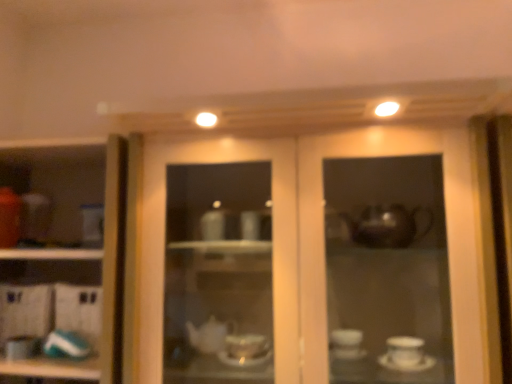
The height and width of the screenshot is (384, 512). Describe the element at coordinates (67, 255) in the screenshot. I see `white glossy cup at left` at that location.

This screenshot has height=384, width=512. What do you see at coordinates (22, 347) in the screenshot?
I see `matte white teapot at lower left, the 2th tableware in the right-to-left sequence` at bounding box center [22, 347].

Locate an element on the screen. matte glass cabinet at center is located at coordinates (311, 240).

Measure the distance between point (57, 330) and camera.

Point (57, 330) is 1.26 meters from camera.

In order to click on white glossy cup at left in this screenshot , I will do `click(67, 255)`.

Does white glossy cup at left appear on the right side of matte glass cabinet at center?

Incorrect, white glossy cup at left is not on the right side of matte glass cabinet at center.

How many degrees apart are the facing directions of white glossy cup at left and matte glass cabinet at center?

The facing directions of white glossy cup at left and matte glass cabinet at center are 0.000178 degrees apart.

From a real-world perspective, is white glossy cup at left above or below matte glass cabinet at center?

white glossy cup at left is below matte glass cabinet at center.

From the image's perspective, would you say matte glass cabinet at center is positioned over white glossy cup at left?

Correct, matte glass cabinet at center appears higher than white glossy cup at left in the image.

Would you consider matte glass cabinet at center to be distant from white glossy cup at left?

matte glass cabinet at center is actually quite close to white glossy cup at left.

Which is in front, matte glass cabinet at center or white glossy cup at left?

matte glass cabinet at center is in front.

Considering the relative positions of matte glass cabinet at center and white glossy cup at left in the image provided, is matte glass cabinet at center to the left of white glossy cup at left from the viewer's perspective?

Incorrect, matte glass cabinet at center is not on the left side of white glossy cup at left.

Based on the photo, is matte white teapot at lower left, the 2th tableware in the right-to-left sequence, at the right side of teal glossy plate at lower left, which appears as the first tableware when viewed from the right?

In fact, matte white teapot at lower left, the 2th tableware in the right-to-left sequence, is to the left of teal glossy plate at lower left, which appears as the first tableware when viewed from the right.

How different are the orientations of matte white teapot at lower left, the 2th tableware in the right-to-left sequence, and teal glossy plate at lower left, the second tableware when ordered from left to right, in degrees?

1.65 degrees.

Is matte white teapot at lower left, which ranks as the first tableware in left-to-right order, oriented away from teal glossy plate at lower left, which appears as the first tableware when viewed from the right?

No, matte white teapot at lower left, which ranks as the first tableware in left-to-right order,'s orientation is not away from teal glossy plate at lower left, which appears as the first tableware when viewed from the right.

Identify the location of tableware above the matte white teapot at lower left, the 2th tableware in the right-to-left sequence (from the image's perspective). (66, 345).

From a real-world perspective, is teal glossy plate at lower left, the second tableware when ordered from left to right, on matte white teapot at lower left, which ranks as the first tableware in left-to-right order?

Yes, from a real-world perspective, teal glossy plate at lower left, the second tableware when ordered from left to right, is on top of matte white teapot at lower left, which ranks as the first tableware in left-to-right order.

Considering the positions of objects teal glossy plate at lower left, which appears as the first tableware when viewed from the right, and matte white teapot at lower left, which ranks as the first tableware in left-to-right order, in the image provided, who is behind, teal glossy plate at lower left, which appears as the first tableware when viewed from the right, or matte white teapot at lower left, which ranks as the first tableware in left-to-right order,?

teal glossy plate at lower left, which appears as the first tableware when viewed from the right.

Can you confirm if teal glossy plate at lower left, the second tableware when ordered from left to right, is bigger than matte white teapot at lower left, which ranks as the first tableware in left-to-right order?

No, teal glossy plate at lower left, the second tableware when ordered from left to right, is not bigger than matte white teapot at lower left, which ranks as the first tableware in left-to-right order.

Is matte white teapot at lower left, the 2th tableware in the right-to-left sequence, spatially inside matte glass cabinet at center, or outside of it?

matte white teapot at lower left, the 2th tableware in the right-to-left sequence, is spatially situated outside matte glass cabinet at center.

Can you confirm if matte white teapot at lower left, the 2th tableware in the right-to-left sequence, is smaller than matte glass cabinet at center?

Yes, matte white teapot at lower left, the 2th tableware in the right-to-left sequence, is smaller than matte glass cabinet at center.

In terms of height, does matte white teapot at lower left, the 2th tableware in the right-to-left sequence, look taller or shorter compared to matte glass cabinet at center?

In the image, matte white teapot at lower left, the 2th tableware in the right-to-left sequence, appears to be shorter than matte glass cabinet at center.

Considering the relative sizes of matte white teapot at lower left, the 2th tableware in the right-to-left sequence, and white glossy cup at left in the image provided, is matte white teapot at lower left, the 2th tableware in the right-to-left sequence, bigger than white glossy cup at left?

No.

You are a GUI agent. You are given a task and a screenshot of the screen. Output one action in this format:
    pyautogui.click(x=<x>, y=<y>)
    Task: Click on the cupboard that is above the matte white teapot at lower left, which ranks as the first tableware in left-to-right order (from a real-world perspective)
    The image size is (512, 384).
    Given the screenshot: What is the action you would take?
    pyautogui.click(x=67, y=255)

Is white glossy cup at left located within matte white teapot at lower left, the 2th tableware in the right-to-left sequence?

Definitely not — white glossy cup at left is not inside matte white teapot at lower left, the 2th tableware in the right-to-left sequence.

From a real-world perspective, is matte white teapot at lower left, which ranks as the first tableware in left-to-right order, positioned over white glossy cup at left based on gravity?

No, from a real-world perspective, matte white teapot at lower left, which ranks as the first tableware in left-to-right order, is not over white glossy cup at left

Looking at this image, can you tell me how much matte glass cabinet at center and teal glossy plate at lower left, which appears as the first tableware when viewed from the right, differ in facing direction?

There is a 4.08-degree angle between the facing directions of matte glass cabinet at center and teal glossy plate at lower left, which appears as the first tableware when viewed from the right.

Looking at this image, are matte glass cabinet at center and teal glossy plate at lower left, which appears as the first tableware when viewed from the right, far apart?

matte glass cabinet at center is actually quite close to teal glossy plate at lower left, which appears as the first tableware when viewed from the right.

From a real-world perspective, who is located lower, matte glass cabinet at center or teal glossy plate at lower left, the second tableware when ordered from left to right?

teal glossy plate at lower left, the second tableware when ordered from left to right, from a real-world perspective.

Between matte glass cabinet at center and teal glossy plate at lower left, which appears as the first tableware when viewed from the right, which one is positioned in front?

matte glass cabinet at center is in front.

Locate an element on the screen. The image size is (512, 384). door that appears above the white glossy cup at left (from the image's perspective) is located at coordinates (311, 240).

Where is `cupboard behind the matte glass cabinet at center`? The width and height of the screenshot is (512, 384). cupboard behind the matte glass cabinet at center is located at coordinates (67, 255).

From the image, which object appears to be farther from teal glossy plate at lower left, the second tableware when ordered from left to right, matte white teapot at lower left, the 2th tableware in the right-to-left sequence, or white glossy cup at left?

white glossy cup at left.

Which object lies nearer to the anchor point matte white teapot at lower left, the 2th tableware in the right-to-left sequence, matte glass cabinet at center or white glossy cup at left?

white glossy cup at left lies closer to matte white teapot at lower left, the 2th tableware in the right-to-left sequence, than the other object.

Which object lies further to the anchor point teal glossy plate at lower left, the second tableware when ordered from left to right, matte white teapot at lower left, which ranks as the first tableware in left-to-right order, or matte glass cabinet at center?

Based on the image, matte glass cabinet at center appears to be further to teal glossy plate at lower left, the second tableware when ordered from left to right.

Estimate the real-world distances between objects in this image. Which object is closer to matte white teapot at lower left, which ranks as the first tableware in left-to-right order, matte glass cabinet at center or teal glossy plate at lower left, the second tableware when ordered from left to right?

teal glossy plate at lower left, the second tableware when ordered from left to right, is closer to matte white teapot at lower left, which ranks as the first tableware in left-to-right order.

From the image, which object appears to be nearer to matte white teapot at lower left, which ranks as the first tableware in left-to-right order, teal glossy plate at lower left, the second tableware when ordered from left to right, or white glossy cup at left?

teal glossy plate at lower left, the second tableware when ordered from left to right, lies closer to matte white teapot at lower left, which ranks as the first tableware in left-to-right order, than the other object.

Estimate the real-world distances between objects in this image. Which object is further from teal glossy plate at lower left, the second tableware when ordered from left to right, white glossy cup at left or matte white teapot at lower left, the 2th tableware in the right-to-left sequence?

white glossy cup at left lies further to teal glossy plate at lower left, the second tableware when ordered from left to right, than the other object.

Based on the photo, when comparing their distances from teal glossy plate at lower left, the second tableware when ordered from left to right, does white glossy cup at left or matte glass cabinet at center seem closer?

white glossy cup at left is positioned closer to the anchor teal glossy plate at lower left, the second tableware when ordered from left to right.

Which object lies nearer to the anchor point matte glass cabinet at center, white glossy cup at left or teal glossy plate at lower left, which appears as the first tableware when viewed from the right?

The object closer to matte glass cabinet at center is white glossy cup at left.

The image size is (512, 384). Identify the location of tableware between matte white teapot at lower left, the 2th tableware in the right-to-left sequence, and matte glass cabinet at center, in the horizontal direction. (66, 345).

I want to click on tableware situated between white glossy cup at left and matte glass cabinet at center from left to right, so click(x=66, y=345).

The height and width of the screenshot is (384, 512). I want to click on cupboard situated between matte white teapot at lower left, which ranks as the first tableware in left-to-right order, and matte glass cabinet at center from left to right, so click(x=67, y=255).

The width and height of the screenshot is (512, 384). In order to click on tableware between white glossy cup at left and matte white teapot at lower left, the 2th tableware in the right-to-left sequence, in the up-down direction in this screenshot , I will do `click(66, 345)`.